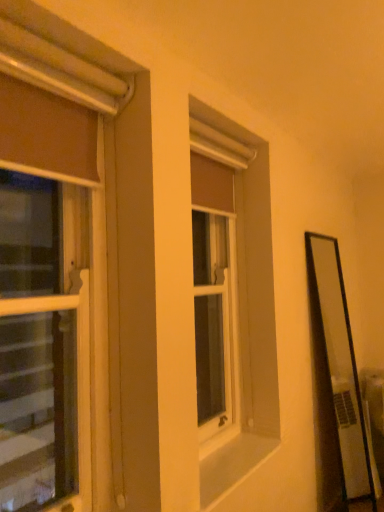
What is the approximate height of matte brown curtain at left, which is counted as the 2th window, starting from the back?

matte brown curtain at left, which is counted as the 2th window, starting from the back, is 4.48 feet in height.

Identify the location of matte brown curtain at center, marked as the second window in a front-to-back arrangement. This screenshot has width=384, height=512. (214, 297).

Considering the sizes of objects matte brown curtain at left, which ranks as the second window in right-to-left order, and matte brown curtain at center, which is the 1th window in right-to-left order, in the image provided, who is taller, matte brown curtain at left, which ranks as the second window in right-to-left order, or matte brown curtain at center, which is the 1th window in right-to-left order,?

matte brown curtain at left, which ranks as the second window in right-to-left order, is taller.

Is matte brown curtain at center, which is the 1th window in right-to-left order, at the back of matte brown curtain at left, marked as the first window in a front-to-back arrangement?

No, matte brown curtain at left, marked as the first window in a front-to-back arrangement,'s orientation is not away from matte brown curtain at center, which is the 1th window in right-to-left order.

Consider the image. From a real-world perspective, which object stands above the other?

matte brown curtain at left, which ranks as the second window in right-to-left order, is physically above.

From a real-world perspective, is matte brown curtain at center, the first window positioned from the back, located higher than white smooth window sill at center?

Yes, from a real-world perspective, matte brown curtain at center, the first window positioned from the back, is above white smooth window sill at center.

Who is smaller, matte brown curtain at center, which ranks as the second window in left-to-right order, or white smooth window sill at center?

Smaller between the two is white smooth window sill at center.

At what (x,y) coordinates should I click in order to perform the action: click on the 1st window above the white smooth window sill at center (from the image's perspective). Please return your answer as a coordinate pair (x, y). The image size is (384, 512). Looking at the image, I should click on click(x=214, y=297).

Is matte brown curtain at center, which ranks as the second window in left-to-right order, inside or outside of white smooth window sill at center?

matte brown curtain at center, which ranks as the second window in left-to-right order, is outside white smooth window sill at center.

Does matte brown curtain at left, which appears as the 1th window when viewed from the left, contain white smooth window sill at center?

No, white smooth window sill at center is not inside matte brown curtain at left, which appears as the 1th window when viewed from the left.

Is the surface of matte brown curtain at left, which appears as the 1th window when viewed from the left, in direct contact with white smooth window sill at center?

There is a gap between matte brown curtain at left, which appears as the 1th window when viewed from the left, and white smooth window sill at center.

Considering the positions of point (28, 273) and point (205, 460), is point (28, 273) closer or farther from the camera than point (205, 460)?

Point (28, 273).

Between matte brown curtain at left, which appears as the 1th window when viewed from the left, and white smooth window sill at center, which one has smaller size?

Smaller between the two is white smooth window sill at center.

Between white smooth window sill at center and matte brown curtain at left, which appears as the 1th window when viewed from the left, which one has smaller size?

white smooth window sill at center.

Locate an element on the screen. The width and height of the screenshot is (384, 512). window sill that is behind the matte brown curtain at left, which appears as the 1th window when viewed from the left is located at coordinates tap(231, 464).

Looking at this image, between white smooth window sill at center and matte brown curtain at left, which is counted as the 2th window, starting from the back, which one has more height?

matte brown curtain at left, which is counted as the 2th window, starting from the back.

Identify the location of window behind the matte brown curtain at left, marked as the first window in a front-to-back arrangement. The width and height of the screenshot is (384, 512). (214, 297).

From the image's perspective, is matte brown curtain at center, marked as the second window in a front-to-back arrangement, beneath matte brown curtain at left, which is counted as the 2th window, starting from the back?

Indeed, from the image's perspective, matte brown curtain at center, marked as the second window in a front-to-back arrangement, is shown beneath matte brown curtain at left, which is counted as the 2th window, starting from the back.

From a real-world perspective, which object stands above the other?

matte brown curtain at left, which ranks as the second window in right-to-left order, from a real-world perspective.

Between point (198, 394) and point (89, 174), which one is positioned in front?

Point (89, 174)

From the picture: Is white smooth window sill at center placed right next to matte brown curtain at center, which is the 1th window in right-to-left order?

No.

Can you tell me how much white smooth window sill at center and matte brown curtain at center, which is the 1th window in right-to-left order, differ in facing direction?

white smooth window sill at center and matte brown curtain at center, which is the 1th window in right-to-left order, are facing 0.609 degrees away from each other.

Which of these two, white smooth window sill at center or matte brown curtain at center, marked as the second window in a front-to-back arrangement, stands taller?

Standing taller between the two is matte brown curtain at center, marked as the second window in a front-to-back arrangement.

Identify the location of the 1st window positioned above the white smooth window sill at center (from the image's perspective). This screenshot has width=384, height=512. (214, 297).

Where is `window on the left of matte brown curtain at center, the first window positioned from the back`? This screenshot has height=512, width=384. window on the left of matte brown curtain at center, the first window positioned from the back is located at coordinates (69, 270).

From the image's perspective, count 1st windows upward from the white smooth window sill at center and point to it. Please provide its 2D coordinates.

[(214, 297)]

Based on their spatial positions, is matte brown curtain at left, which is counted as the 2th window, starting from the back, or white smooth window sill at center further from matte brown curtain at center, the first window positioned from the back?

matte brown curtain at left, which is counted as the 2th window, starting from the back.

Estimate the real-world distances between objects in this image. Which object is further from white smooth window sill at center, matte brown curtain at center, which is the 1th window in right-to-left order, or matte brown curtain at left, which ranks as the second window in right-to-left order?

Among the two, matte brown curtain at left, which ranks as the second window in right-to-left order, is located further to white smooth window sill at center.

Estimate the real-world distances between objects in this image. Which object is closer to white smooth window sill at center, matte brown curtain at left, which ranks as the second window in right-to-left order, or matte brown curtain at center, marked as the second window in a front-to-back arrangement?

Among the two, matte brown curtain at center, marked as the second window in a front-to-back arrangement, is located nearer to white smooth window sill at center.

Based on their spatial positions, is white smooth window sill at center or matte brown curtain at center, marked as the second window in a front-to-back arrangement, closer to matte brown curtain at left, marked as the first window in a front-to-back arrangement?

white smooth window sill at center lies closer to matte brown curtain at left, marked as the first window in a front-to-back arrangement, than the other object.

Which object lies further to the anchor point matte brown curtain at center, marked as the second window in a front-to-back arrangement, white smooth window sill at center or matte brown curtain at left, which appears as the 1th window when viewed from the left?

matte brown curtain at left, which appears as the 1th window when viewed from the left.

Based on their spatial positions, is matte brown curtain at center, which is the 1th window in right-to-left order, or white smooth window sill at center closer to matte brown curtain at left, which appears as the 1th window when viewed from the left?

Answer: white smooth window sill at center lies closer to matte brown curtain at left, which appears as the 1th window when viewed from the left, than the other object.

Find the location of a particular element. window that lies between matte brown curtain at left, which appears as the 1th window when viewed from the left, and white smooth window sill at center from top to bottom is located at coordinates (214, 297).